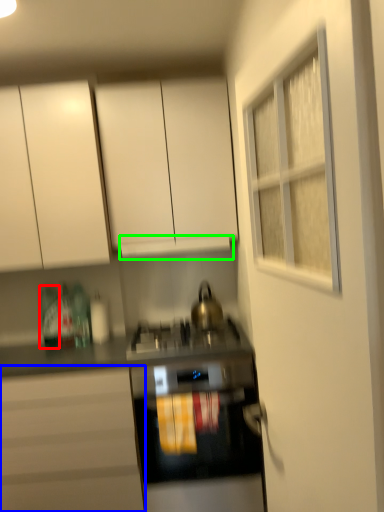
Question: Considering the real-world distances, which object is closest to bottle (highlighted by a red box)? cabinetry (highlighted by a blue box) or exhaust hood (highlighted by a green box).

Choices:
 (A) cabinetry
 (B) exhaust hood

Answer: (A)